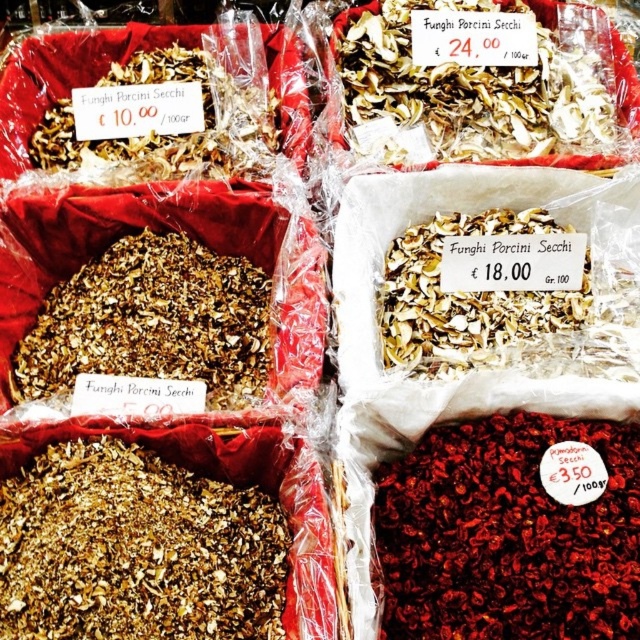
What is the spatial relationship between the dried red berries at lower right and the other objects in the scene?

The dried red berries at lower right are positioned at coordinates point (506, 534), which places them in the lower right section of the image.

You are a customer at a market stall and want to buy both the brown crumbly dried mushrooms at center and the white dried mushrooms at upper center. The vendor says you can only purchase items within a 36 inch reach. Can you grab both without moving from your current position?

The brown crumbly dried mushrooms at center is 38.37 inches away from the white dried mushrooms at upper center, which exceeds the 36 inch reach limit. Therefore, you cannot grab both items without moving.